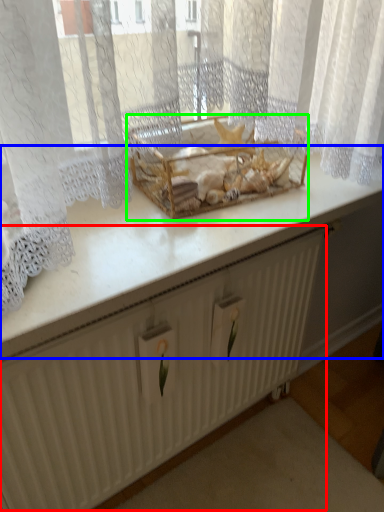
Question: Which object is positioned closest to radiator (highlighted by a red box)? Select from counter top (highlighted by a blue box) and crate (highlighted by a green box).

Choices:
 (A) counter top
 (B) crate

Answer: (A)